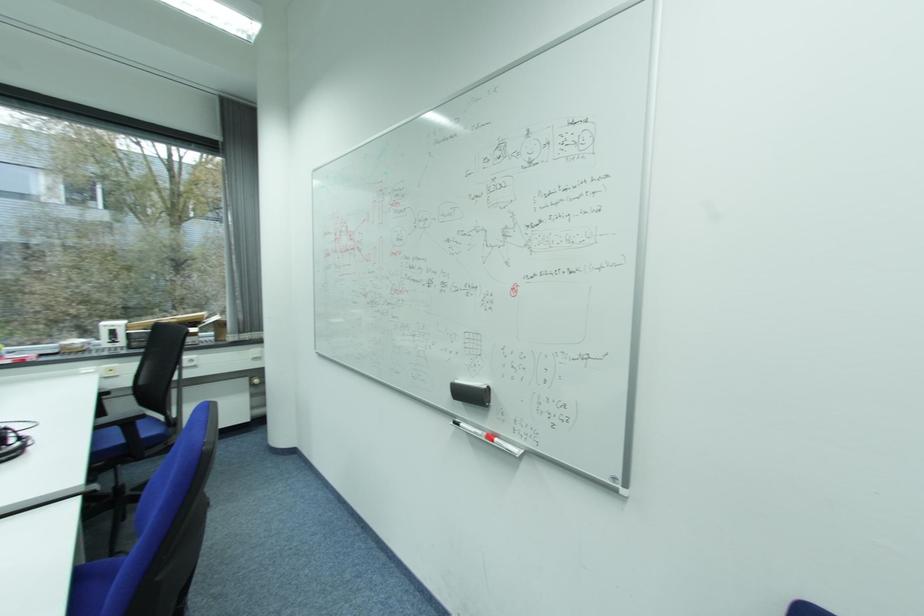
At what (x,y) coordinates should I click in order to perform the action: click on black headphones. Please return your answer as a coordinate pair (x, y). This screenshot has width=924, height=616. Looking at the image, I should click on (15, 438).